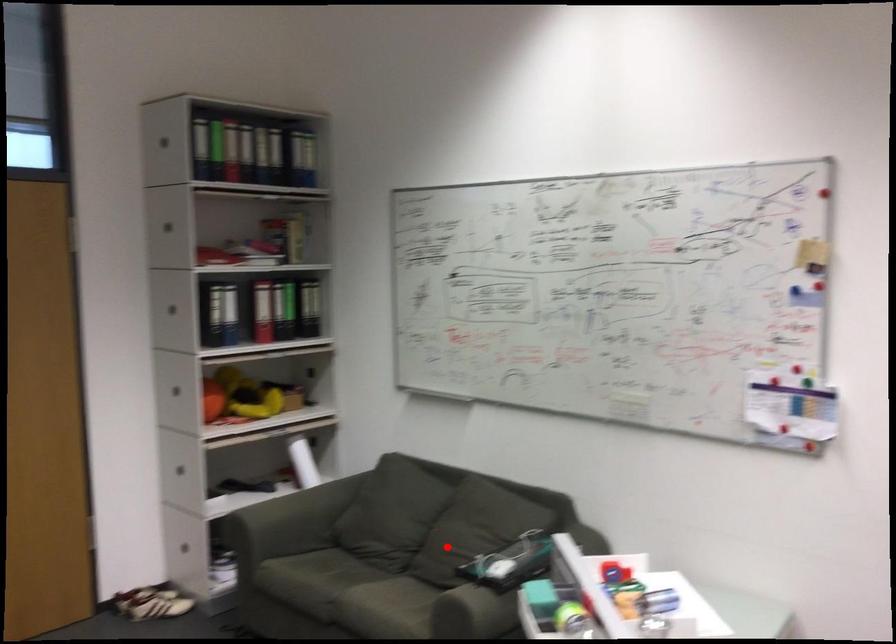
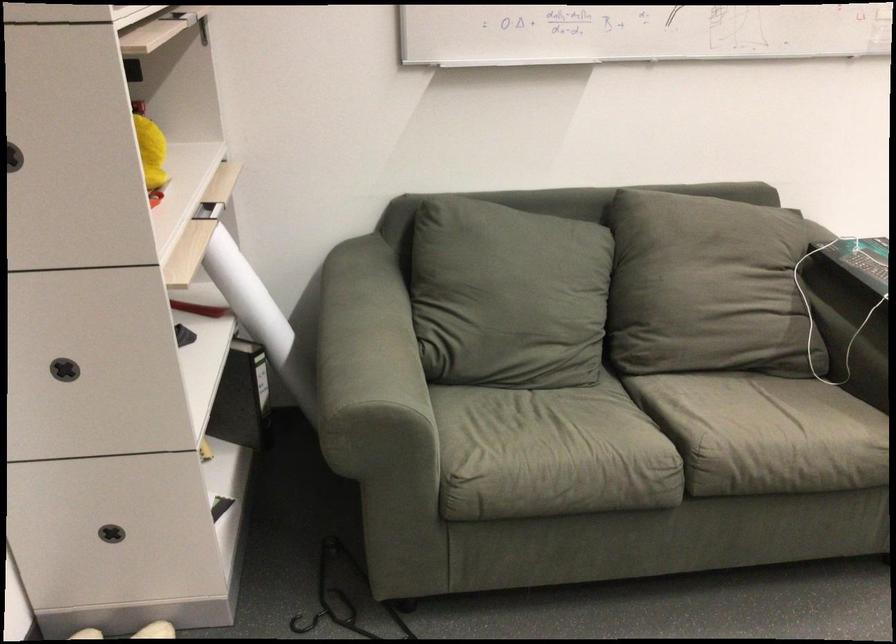
Locate, in the second image, the point that corresponds to the highlighted location in the first image.

(707, 287)